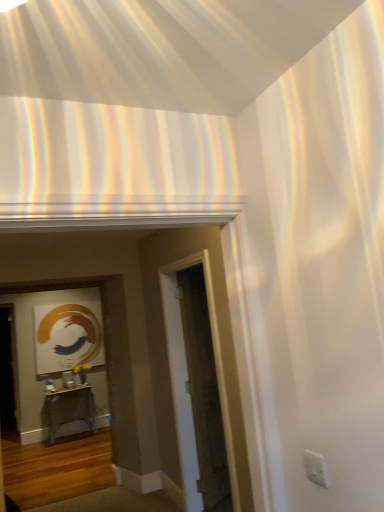
Question: Can you confirm if transparent glass door at center is thinner than metallic silver table at center?

Choices:
 (A) yes
 (B) no

Answer: (A)

Question: Would you consider transparent glass door at center to be distant from metallic silver table at center?

Choices:
 (A) yes
 (B) no

Answer: (A)

Question: Is transparent glass door at center at the left side of metallic silver table at center?

Choices:
 (A) yes
 (B) no

Answer: (B)

Question: Is transparent glass door at center oriented towards metallic silver table at center?

Choices:
 (A) yes
 (B) no

Answer: (B)

Question: Is transparent glass door at center closer to camera compared to metallic silver table at center?

Choices:
 (A) yes
 (B) no

Answer: (A)

Question: Is transparent glass door at center outside of metallic silver table at center?

Choices:
 (A) yes
 (B) no

Answer: (A)

Question: Does metallic silver table at center have a greater height compared to transparent glass door at center?

Choices:
 (A) no
 (B) yes

Answer: (A)

Question: From a real-world perspective, is metallic silver table at center physically above transparent glass door at center?

Choices:
 (A) no
 (B) yes

Answer: (A)

Question: Does metallic silver table at center have a smaller size compared to transparent glass door at center?

Choices:
 (A) no
 (B) yes

Answer: (A)

Question: Is metallic silver table at center positioned in front of transparent glass door at center?

Choices:
 (A) yes
 (B) no

Answer: (B)

Question: Is metallic silver table at center positioned with its back to transparent glass door at center?

Choices:
 (A) no
 (B) yes

Answer: (A)

Question: Is metallic silver table at center beside transparent glass door at center?

Choices:
 (A) yes
 (B) no

Answer: (B)

Question: Is metallic silver table at center in front of or behind transparent glass door at center in the image?

Choices:
 (A) behind
 (B) front

Answer: (A)